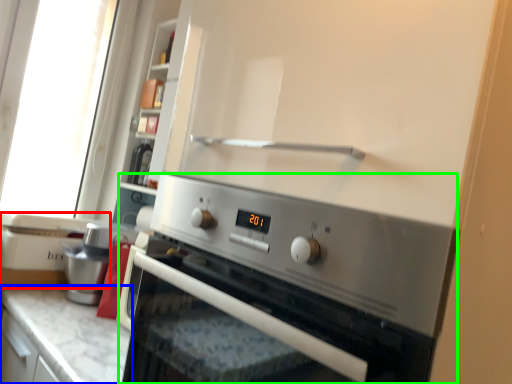
Question: Based on their relative distances, which object is farther from appliance (highlighted by a red box)? Choose from countertop (highlighted by a blue box) and home appliance (highlighted by a green box).

Choices:
 (A) countertop
 (B) home appliance

Answer: (B)